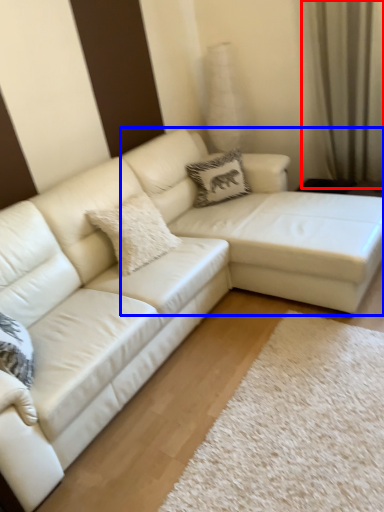
Question: Which of the following is the farthest to the observer, curtain (highlighted by a red box) or couch (highlighted by a blue box)?

Choices:
 (A) curtain
 (B) couch

Answer: (A)